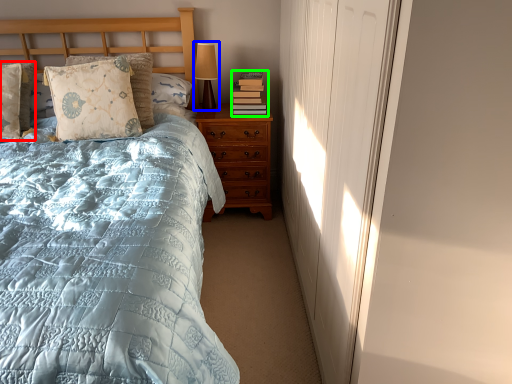
Question: Considering the real-world distances, which object is farthest from pillow (highlighted by a red box)? table lamp (highlighted by a blue box) or book (highlighted by a green box)?

Choices:
 (A) table lamp
 (B) book

Answer: (B)